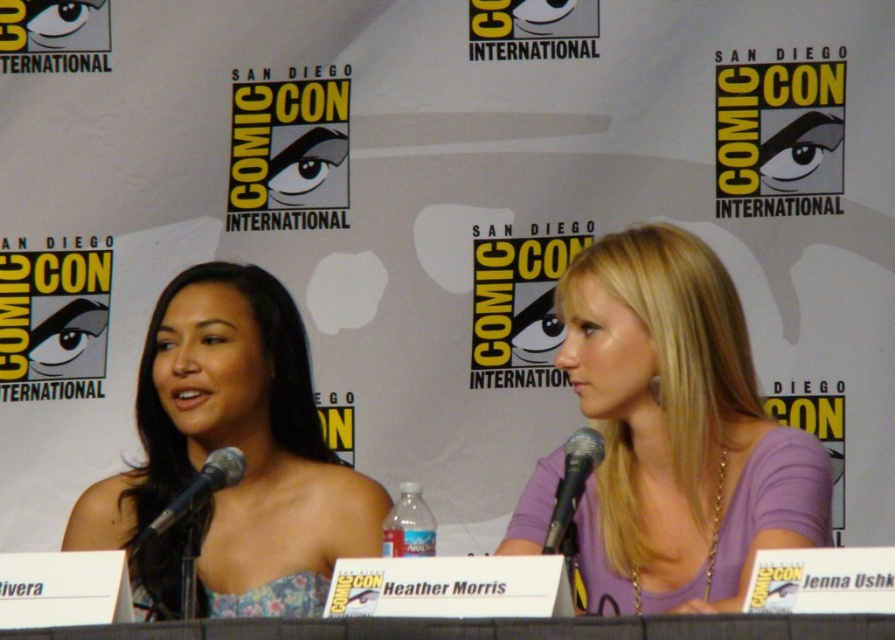
You are a photographer at the event and need to capture a clear photo of the purple fabric shirt at center. Your camera has a minimum focus distance of 8 feet. Can you focus on the shirt without moving closer?

The purple fabric shirt at center and camera are 8.81 feet apart, so yes, the camera can focus on the purple fabric shirt at center since the distance is within the minimum focus distance requirement of 8 feet.

You are a photographer at the event and want to capture a clear shot of the floral fabric dress at left without the black metallic microphone at left blocking it. How can you adjust your camera angle to ensure the dress is fully visible?

The floral fabric dress at left is positioned over the black metallic microphone at left. To capture the dress without obstruction, move your camera angle slightly downward so the dress appears above the microphone.

You are an event photographer at San Diego Comic Con. You need to capture a close up of the black metallic microphone at left without the floral fabric dress at left appearing in the frame. Is this possible given their sizes?

The floral fabric dress at left is bigger than the black metallic microphone at left, so it may be challenging to frame the microphone without the dress appearing in the shot due to its larger size.